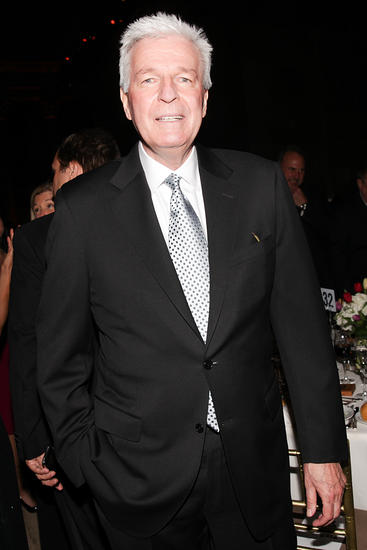
This screenshot has width=367, height=550. Find the location of `table`. table is located at coordinates (357, 463).